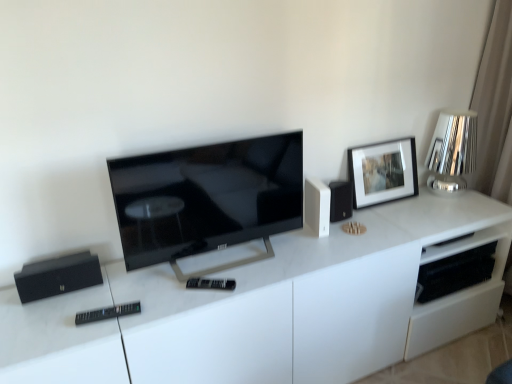
Question: Is black plastic remote at lower left, marked as the 1th remote in a bottom-to-top arrangement, situated inside white glossy cabinet at center or outside?

Choices:
 (A) outside
 (B) inside

Answer: (A)

Question: Does point (112, 317) appear closer or farther from the camera than point (176, 284)?

Choices:
 (A) farther
 (B) closer

Answer: (B)

Question: Estimate the real-world distances between objects in this image. Which object is closer to the matte black tv at center?

Choices:
 (A) black matte speaker at left
 (B) shiny metallic lamp at upper right
 (C) matte black picture frame at upper right
 (D) white matte speaker at upper right
 (E) white glossy cabinet at center

Answer: (E)

Question: Which object is positioned farthest from the white matte speaker at upper right?

Choices:
 (A) black plastic remote at center, which ranks as the first remote in top-to-bottom order
 (B) black plastic remote at lower left, marked as the 1th remote in a bottom-to-top arrangement
 (C) white glossy cabinet at center
 (D) matte black tv at center
 (E) matte black picture frame at upper right

Answer: (B)